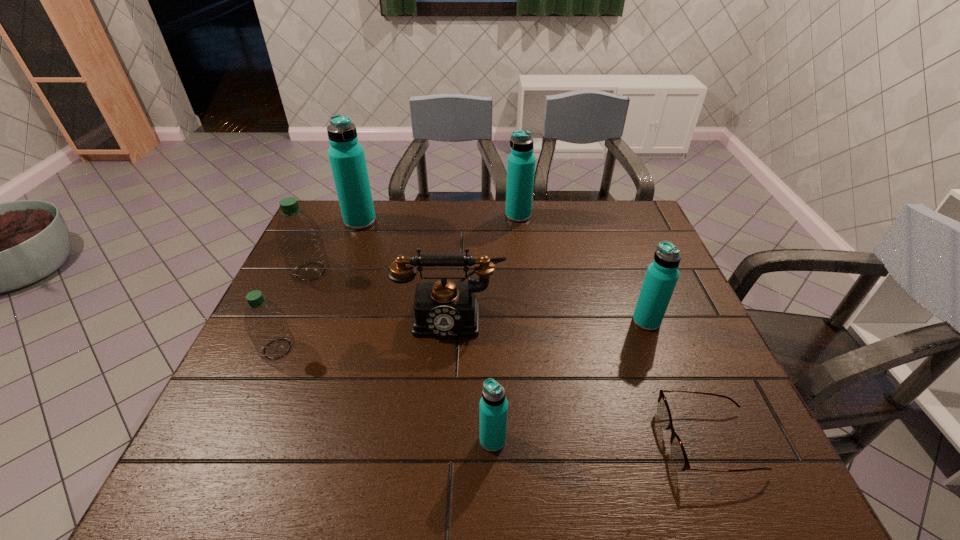
The width and height of the screenshot is (960, 540). I want to click on vacant area between the spectacles and the fourth nearest water bottle, so click(x=510, y=356).

Where is `free area in between the spectacles and the sixth nearest object`? The width and height of the screenshot is (960, 540). free area in between the spectacles and the sixth nearest object is located at coordinates (510, 356).

At what (x,y) coordinates should I click in order to perform the action: click on free point between the third blue water bottle from left to right and the tallest object. Please return your answer as a coordinate pair (x, y). This screenshot has width=960, height=540. Looking at the image, I should click on (439, 219).

Image resolution: width=960 pixels, height=540 pixels. In order to click on unoccupied area between the farther green water bottle and the rightmost water bottle in this screenshot , I will do `click(478, 296)`.

Identify the location of free spot between the shortest object and the nearest blue water bottle. (601, 441).

Locate an element on the screen. The height and width of the screenshot is (540, 960). free space that is in between the third farthest water bottle and the leftmost blue water bottle is located at coordinates (335, 247).

At what (x,y) coordinates should I click in order to perform the action: click on object that can be found as the sixth closest to the third object from right to left. Please return your answer as a coordinate pair (x, y). Image resolution: width=960 pixels, height=540 pixels. Looking at the image, I should click on (265, 323).

I want to click on object that is the third closest to the fourth water bottle from left to right, so click(x=662, y=274).

This screenshot has height=540, width=960. Find the location of `the fourth closest water bottle to the shortest object`. the fourth closest water bottle to the shortest object is located at coordinates (265, 323).

Find the location of `water bottle that is the second closest to the shortest object`. water bottle that is the second closest to the shortest object is located at coordinates (493, 408).